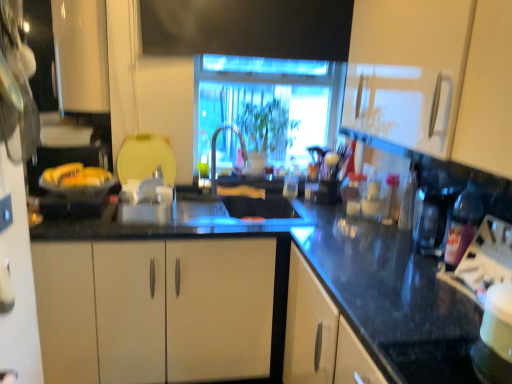
Measure the distance between satin nickel faucet at center and camera.

satin nickel faucet at center is 2.36 meters from camera.

Measure the distance between point (286, 149) and camera.

They are 2.54 meters apart.

Describe the element at coordinates (81, 55) in the screenshot. This screenshot has width=512, height=384. I see `white glossy cabinet at upper left, marked as the 2th cabinetry in a right-to-left arrangement` at that location.

The width and height of the screenshot is (512, 384). Find the location of `translucent plastic bottle at center, which is counted as the second bottle, starting from the front`. translucent plastic bottle at center, which is counted as the second bottle, starting from the front is located at coordinates (291, 182).

Is transparent glass window at center to the right of translucent plastic bottle at center, which ranks as the 1th bottle in back-to-front order, from the viewer's perspective?

Incorrect, transparent glass window at center is not on the right side of translucent plastic bottle at center, which ranks as the 1th bottle in back-to-front order.

From the image's perspective, which is above, transparent glass window at center or translucent plastic bottle at center, which is counted as the second bottle, starting from the front?

transparent glass window at center appears higher in the image.

Which point is more forward, (340, 95) or (289, 196)?

Point (340, 95)

Is transparent glass window at center aimed at translucent plastic bottle at center, which appears as the second bottle when viewed from the right?

Yes.

Between translucent plastic bottle at center, which ranks as the 1th bottle in back-to-front order, and translucent purple bottle at right, the 2th bottle from the left, which one appears on the left side from the viewer's perspective?

Positioned to the left is translucent plastic bottle at center, which ranks as the 1th bottle in back-to-front order.

From the image's perspective, between translucent plastic bottle at center, which ranks as the second bottle in bottom-to-top order, and translucent purple bottle at right, the first bottle when ordered from bottom to top, which one is located above?

translucent plastic bottle at center, which ranks as the second bottle in bottom-to-top order, appears higher in the image.

From a real-world perspective, is translucent plastic bottle at center, which ranks as the 1th bottle in back-to-front order, physically located above or below translucent purple bottle at right, the first bottle in the front-to-back sequence?

In terms of real-world spatial position, translucent plastic bottle at center, which ranks as the 1th bottle in back-to-front order, is below translucent purple bottle at right, the first bottle in the front-to-back sequence.

Consider the image. Would you consider satin nickel faucet at center to be distant from white glossy cabinet at upper left, which ranks as the 1th cabinetry in left-to-right order?

No, satin nickel faucet at center is not far from white glossy cabinet at upper left, which ranks as the 1th cabinetry in left-to-right order.

Considering the sizes of objects satin nickel faucet at center and white glossy cabinet at upper left, acting as the 1th cabinetry starting from the back, in the image provided, who is taller, satin nickel faucet at center or white glossy cabinet at upper left, acting as the 1th cabinetry starting from the back,?

Standing taller between the two is white glossy cabinet at upper left, acting as the 1th cabinetry starting from the back.

Is point (214, 175) less distant than point (91, 35)?

No, it is not.

Which object is further away from the camera taking this photo, satin nickel faucet at center or white matte cabinet at upper right, which is the 2th cabinetry from back to front?

satin nickel faucet at center is behind.

Is point (225, 124) closer or farther from the camera than point (367, 86)?

Point (225, 124).

Do you think satin nickel faucet at center is within white matte cabinet at upper right, acting as the 1th cabinetry starting from the right, or outside of it?

satin nickel faucet at center is located beyond the bounds of white matte cabinet at upper right, acting as the 1th cabinetry starting from the right.

Is transparent glass window at center situated inside white glossy cabinet at upper left, acting as the 2th cabinetry starting from the front, or outside?

transparent glass window at center is outside white glossy cabinet at upper left, acting as the 2th cabinetry starting from the front.

Is white glossy cabinet at upper left, which ranks as the 1th cabinetry in left-to-right order, at the back of transparent glass window at center?

transparent glass window at center is not turned away from white glossy cabinet at upper left, which ranks as the 1th cabinetry in left-to-right order.

From the image's perspective, which is above, transparent glass window at center or white glossy cabinet at upper left, acting as the 1th cabinetry starting from the back?

From the image's view, white glossy cabinet at upper left, acting as the 1th cabinetry starting from the back, is above.

Identify the location of window that appears below the white glossy cabinet at upper left, marked as the 2th cabinetry in a right-to-left arrangement (from a real-world perspective). (268, 100).

From the image's perspective, between translucent purple bottle at right, the first bottle in the front-to-back sequence, and white matte cabinet at upper right, the 2th cabinetry in the left-to-right sequence, who is located below?

translucent purple bottle at right, the first bottle in the front-to-back sequence, appears lower in the image.

From a real-world perspective, which is physically below, translucent purple bottle at right, which is the first bottle from right to left, or white matte cabinet at upper right, acting as the 1th cabinetry starting from the right?

translucent purple bottle at right, which is the first bottle from right to left, is physically lower.

Based on the photo, which object is closer to the camera, translucent purple bottle at right, the first bottle in the front-to-back sequence, or white matte cabinet at upper right, which is the 2th cabinetry from back to front?

white matte cabinet at upper right, which is the 2th cabinetry from back to front, is closer to the camera.

Which of these two, translucent purple bottle at right, the 2th bottle from the left, or white matte cabinet at upper right, which is the 2th cabinetry from back to front, is bigger?

white matte cabinet at upper right, which is the 2th cabinetry from back to front, is bigger.

From the image's perspective, which is above, white matte cabinet at upper right, placed as the first cabinetry when sorted from front to back, or translucent plastic bottle at center, which ranks as the second bottle in bottom-to-top order?

white matte cabinet at upper right, placed as the first cabinetry when sorted from front to back, appears higher in the image.

How distant is white matte cabinet at upper right, acting as the 1th cabinetry starting from the right, from translucent plastic bottle at center, which ranks as the 1th bottle in back-to-front order?

A distance of 3.68 feet exists between white matte cabinet at upper right, acting as the 1th cabinetry starting from the right, and translucent plastic bottle at center, which ranks as the 1th bottle in back-to-front order.

Does white matte cabinet at upper right, placed as the first cabinetry when sorted from front to back, appear on the left side of translucent plastic bottle at center, which ranks as the 1th bottle in back-to-front order?

No, white matte cabinet at upper right, placed as the first cabinetry when sorted from front to back, is not to the left of translucent plastic bottle at center, which ranks as the 1th bottle in back-to-front order.

The image size is (512, 384). What are the coordinates of `bottle lying on the left of white matte cabinet at upper right, which is the 2th cabinetry from back to front` in the screenshot? It's located at tap(291, 182).

Where is `window in front of the translucent plastic bottle at center, which ranks as the second bottle in bottom-to-top order`? This screenshot has width=512, height=384. window in front of the translucent plastic bottle at center, which ranks as the second bottle in bottom-to-top order is located at coordinates (268, 100).

You are a GUI agent. You are given a task and a screenshot of the screen. Output one action in this format:
    pyautogui.click(x=<x>, y=<y>)
    Task: Click on the bottle above the translucent purple bottle at right, the first bottle in the front-to-back sequence (from the image's perspective)
    The width and height of the screenshot is (512, 384).
    Given the screenshot: What is the action you would take?
    pyautogui.click(x=291, y=182)

Looking at the image, which one is located closer to translucent purple bottle at right, which is the 2th bottle from back to front, white matte cabinet at upper right, the 2th cabinetry in the left-to-right sequence, or satin nickel faucet at center?

The object closer to translucent purple bottle at right, which is the 2th bottle from back to front, is white matte cabinet at upper right, the 2th cabinetry in the left-to-right sequence.

Based on their spatial positions, is translucent plastic bottle at center, which ranks as the second bottle in bottom-to-top order, or white glossy cabinet at upper left, marked as the 2th cabinetry in a right-to-left arrangement, further from satin nickel faucet at center?

white glossy cabinet at upper left, marked as the 2th cabinetry in a right-to-left arrangement, is further to satin nickel faucet at center.

Looking at the image, which one is located closer to satin nickel faucet at center, translucent plastic bottle at center, which is counted as the second bottle, starting from the front, or white matte cabinet at upper right, acting as the 1th cabinetry starting from the right?

translucent plastic bottle at center, which is counted as the second bottle, starting from the front, is closer to satin nickel faucet at center.

Which object lies further to the anchor point satin nickel faucet at center, translucent plastic bottle at center, which ranks as the 1th bottle in back-to-front order, or translucent purple bottle at right, the first bottle in the front-to-back sequence?

translucent purple bottle at right, the first bottle in the front-to-back sequence, lies further to satin nickel faucet at center than the other object.

In the scene shown: When comparing their distances from translucent purple bottle at right, which is the 2th bottle from back to front, does translucent plastic bottle at center, which ranks as the 1th bottle in left-to-right order, or satin nickel faucet at center seem closer?

→ translucent plastic bottle at center, which ranks as the 1th bottle in left-to-right order.

When comparing their distances from transparent glass window at center, does white glossy cabinet at upper left, which ranks as the 1th cabinetry in left-to-right order, or translucent purple bottle at right, the 2th bottle positioned from the top, seem further?

Based on the image, translucent purple bottle at right, the 2th bottle positioned from the top, appears to be further to transparent glass window at center.

Estimate the real-world distances between objects in this image. Which object is further from satin nickel faucet at center, translucent purple bottle at right, the first bottle in the front-to-back sequence, or white glossy cabinet at upper left, marked as the 2th cabinetry in a right-to-left arrangement?

translucent purple bottle at right, the first bottle in the front-to-back sequence, is positioned further to the anchor satin nickel faucet at center.

Estimate the real-world distances between objects in this image. Which object is closer to satin nickel faucet at center, translucent purple bottle at right, the first bottle in the front-to-back sequence, or translucent plastic bottle at center, which is counted as the second bottle, starting from the front?

translucent plastic bottle at center, which is counted as the second bottle, starting from the front, is closer to satin nickel faucet at center.

At what (x,y) coordinates should I click in order to perform the action: click on bottle positioned between white matte cabinet at upper right, acting as the 1th cabinetry starting from the right, and transparent glass window at center from near to far. Please return your answer as a coordinate pair (x, y). Image resolution: width=512 pixels, height=384 pixels. Looking at the image, I should click on (463, 225).

You are a GUI agent. You are given a task and a screenshot of the screen. Output one action in this format:
    pyautogui.click(x=<x>, y=<y>)
    Task: Click on the window between translucent purple bottle at right, the 2th bottle from the left, and translucent plastic bottle at center, which ranks as the 1th bottle in left-to-right order, from front to back
    This screenshot has width=512, height=384.
    Given the screenshot: What is the action you would take?
    pyautogui.click(x=268, y=100)

Locate an element on the screen. The height and width of the screenshot is (384, 512). window situated between white glossy cabinet at upper left, marked as the 2th cabinetry in a right-to-left arrangement, and translucent plastic bottle at center, which ranks as the 1th bottle in left-to-right order, from left to right is located at coordinates (268, 100).

At what (x,y) coordinates should I click in order to perform the action: click on faucet between translucent purple bottle at right, the first bottle in the front-to-back sequence, and translucent plastic bottle at center, which ranks as the 1th bottle in left-to-right order, from front to back. Please return your answer as a coordinate pair (x, y). The height and width of the screenshot is (384, 512). Looking at the image, I should click on (215, 153).